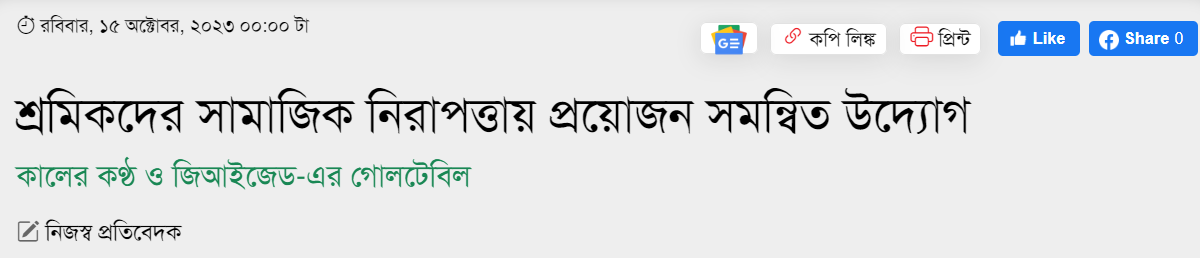
The height and width of the screenshot is (258, 1200). Identify the location of white box with red printer. (930, 51).